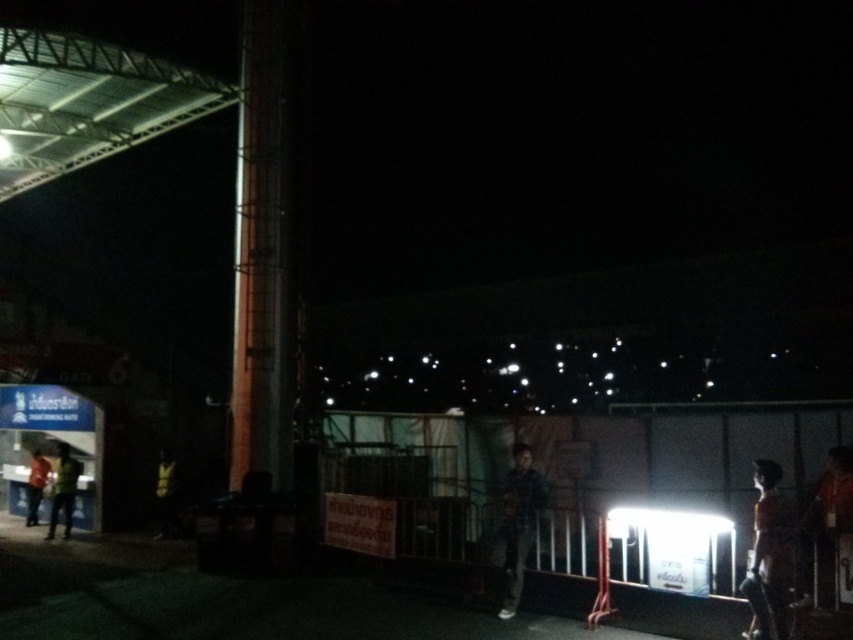
You are standing at the center of the image and want to move towards the dark fabric jacket at left. In which general direction should you move?

You should move towards the left direction to reach the dark fabric jacket at left since it is located at point 0.773 on the x axis which is on the left side of the image.

You are a photographer trying to capture a detailed shot of both the dark fabric jacket at left and the orange shirt at left in the nighttime scene. Since the area is dimly lit, you need to adjust your camera settings. Which object should you focus on first to ensure proper exposure, considering their sizes?

The dark fabric jacket at left has a lesser width compared to the orange shirt at left, so you should focus on the orange shirt at left first because it is larger and might require more light for proper exposure.